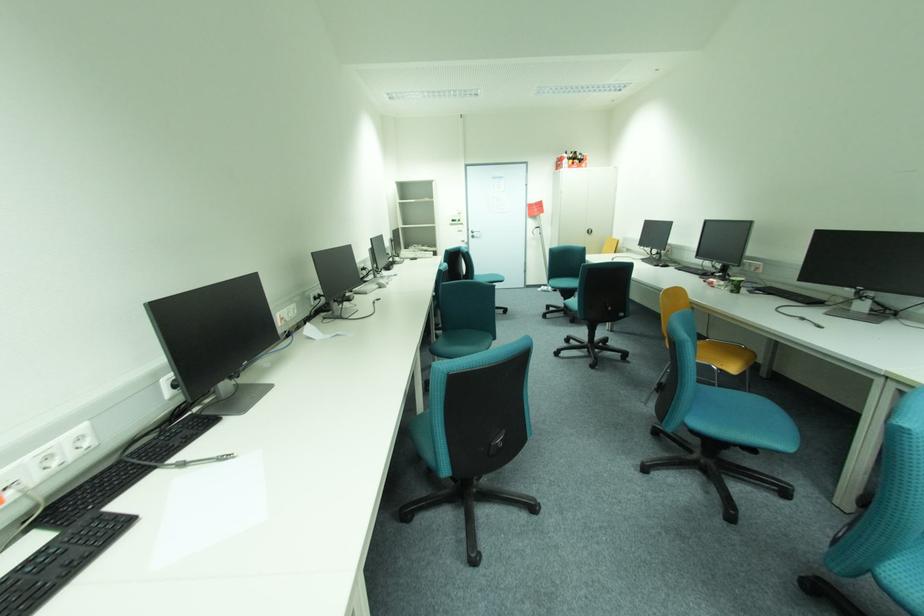
I want to click on yellow chair sitting surface, so click(725, 355).